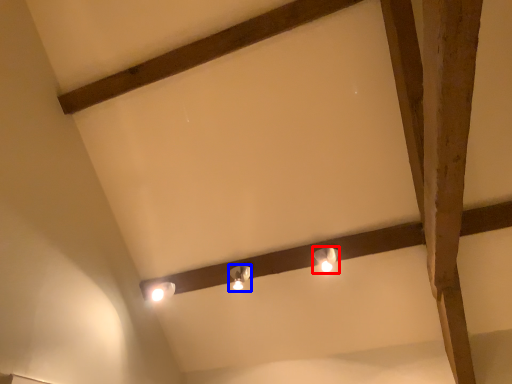
Question: Which of the following is the farthest to the observer, lamp (highlighted by a red box) or lamp (highlighted by a blue box)?

Choices:
 (A) lamp
 (B) lamp

Answer: (B)